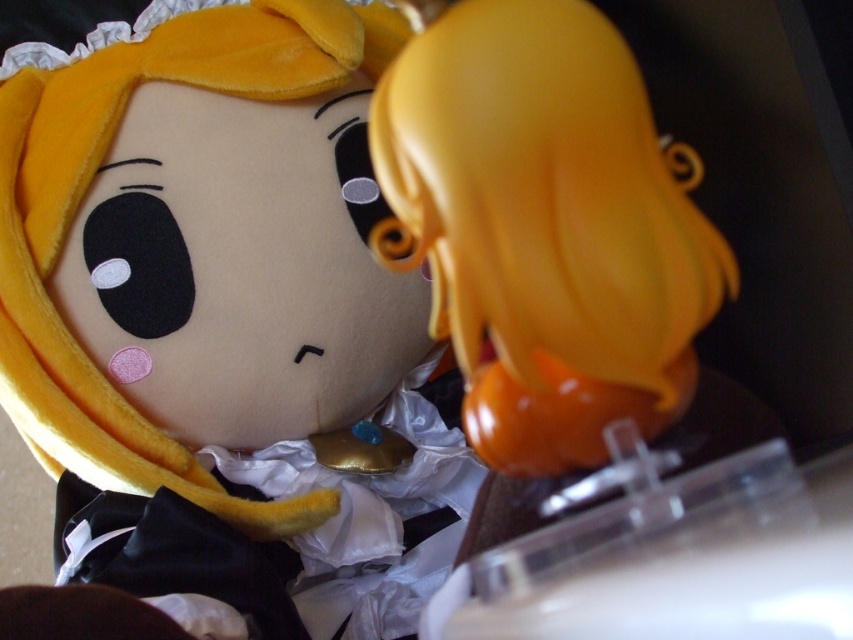
You are a collector of vintage toys and are looking at the velvet yellow plush toy at upper center and the matte orange figurine at center. Which one is closer to you?

The velvet yellow plush toy at upper center is closer to you than the matte orange figurine at center.

You are a toy collector looking to arrange your collection. You have a velvet yellow plush toy at upper center and a matte orange figurine at center. Based on their positions, which toy is positioned higher in the display?

The matte orange figurine at center is positioned higher than the velvet yellow plush toy at upper center because the velvet yellow plush toy at upper center is located below it.

You are a child who wants to give both the velvet yellow plush toy at upper center and the matte orange figurine at center to your friend. Which one should you choose if you want to give the bigger one?

The velvet yellow plush toy at upper center has a larger size compared to the matte orange figurine at center, so you should choose the velvet yellow plush toy at upper center.